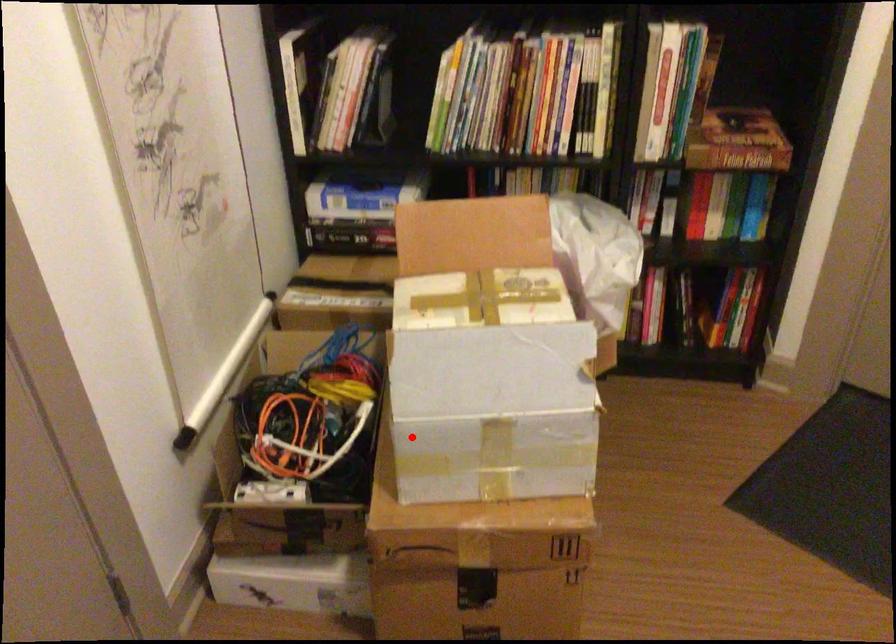
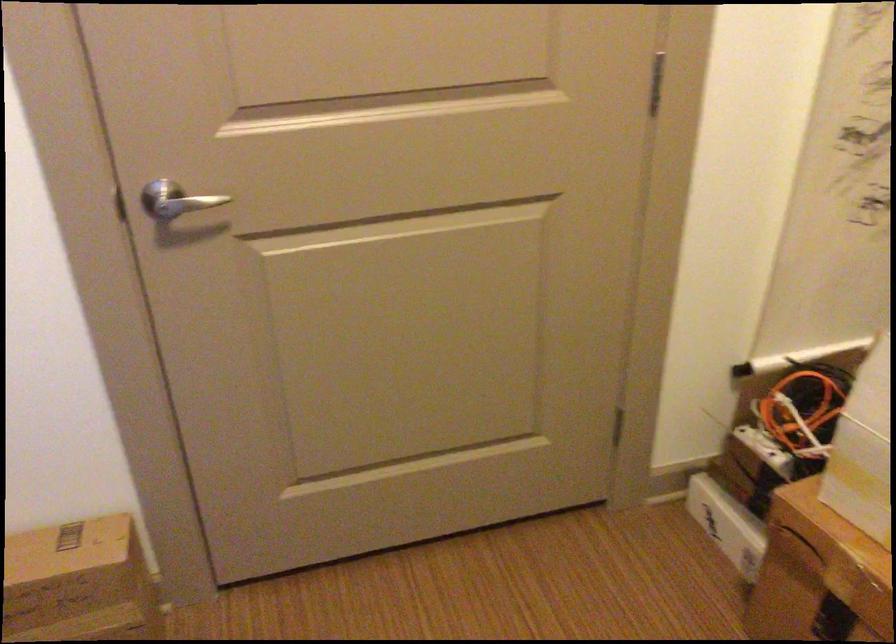
Locate, in the second image, the point that corresponds to the highlighted location in the first image.

(864, 450)